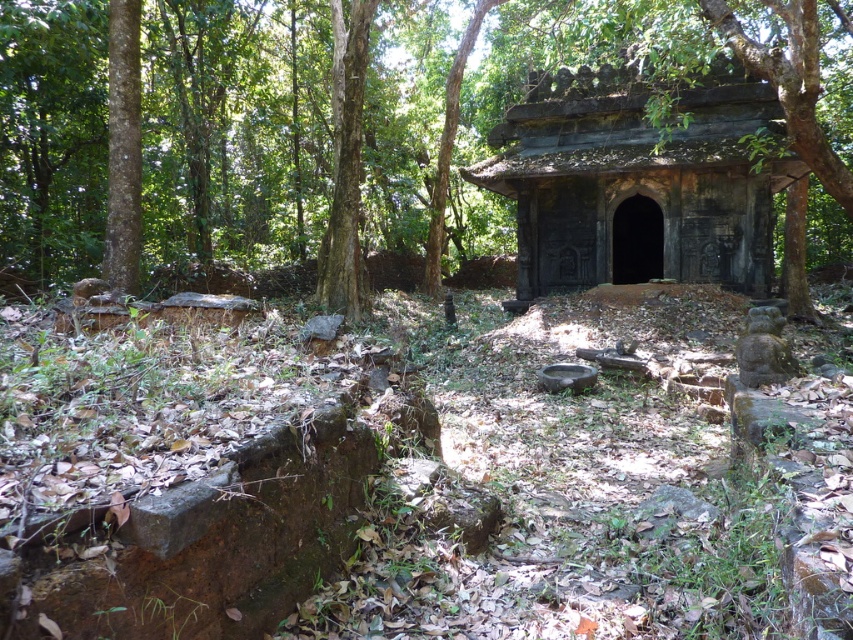
In the scene shown: Does brown rough tree at center come behind dark gray stone hut at center?

No.

Between brown rough tree at center and dark gray stone hut at center, which one appears on the left side from the viewer's perspective?

From the viewer's perspective, brown rough tree at center appears more on the left side.

Is point (103, 230) closer to camera compared to point (534, 76)?

Yes, point (103, 230) is closer to viewer.

I want to click on brown rough tree at center, so click(234, 129).